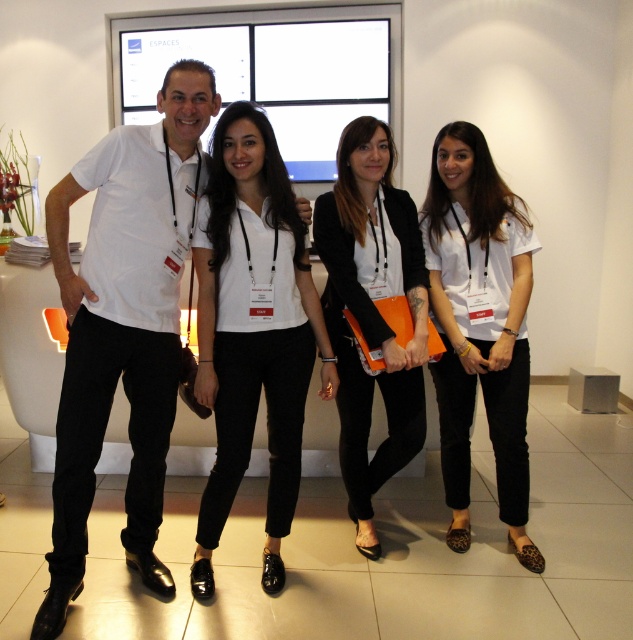
You are standing in the room and want to reach the point at coordinates [287,417]. If your average walking speed is 3 feet per second, how many seconds will it take you to reach that point?

The distance between the point at coordinates [287,417] and the viewer is 7.12 feet. At a speed of 3 feet per second, it would take approximately 2.37 seconds to reach the point.